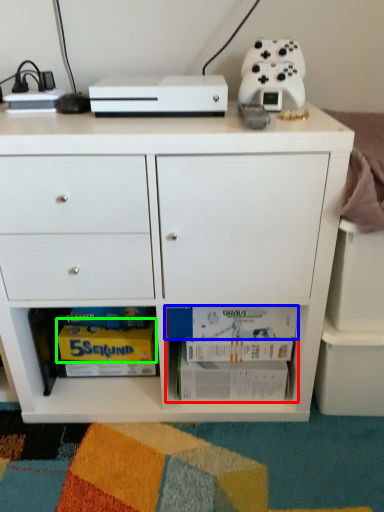
Question: Considering the real-world distances, which object is closest to book (highlighted by a red box)? book (highlighted by a blue box) or magazine (highlighted by a green box).

Choices:
 (A) book
 (B) magazine

Answer: (A)